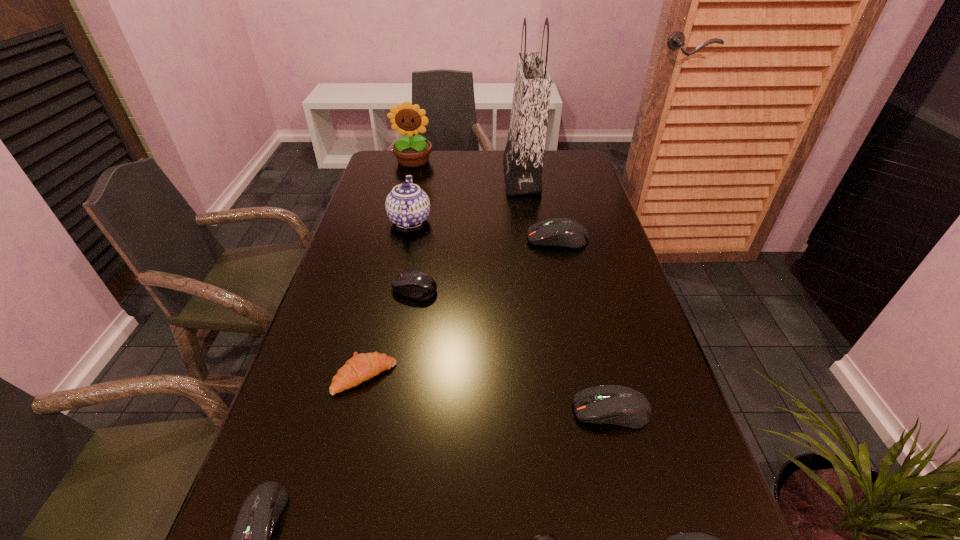
You are a GUI agent. You are given a task and a screenshot of the screen. Output one action in this format:
    pyautogui.click(x=<x>, y=<y>)
    Task: Click on the tallest object
    
    Given the screenshot: What is the action you would take?
    pyautogui.click(x=523, y=157)

Find the location of a particular element. The image size is (960, 540). sunflower is located at coordinates (411, 152).

Image resolution: width=960 pixels, height=540 pixels. Find the location of `the ninth shortest object`. the ninth shortest object is located at coordinates (411, 152).

Locate an element on the screen. chinaware is located at coordinates (407, 206).

Find the location of a particular element. The height and width of the screenshot is (540, 960). blue chinaware is located at coordinates (407, 206).

This screenshot has width=960, height=540. In order to click on the farthest dark computer equipment in this screenshot , I will do `click(562, 232)`.

Where is `the farthest computer equipment`? This screenshot has width=960, height=540. the farthest computer equipment is located at coordinates (562, 232).

The width and height of the screenshot is (960, 540). I want to click on the left black mouse, so click(x=415, y=284).

This screenshot has width=960, height=540. Find the location of `the bigger black mouse`. the bigger black mouse is located at coordinates (415, 284).

Find the location of a particular element. The width and height of the screenshot is (960, 540). the third smallest dark computer equipment is located at coordinates (620, 405).